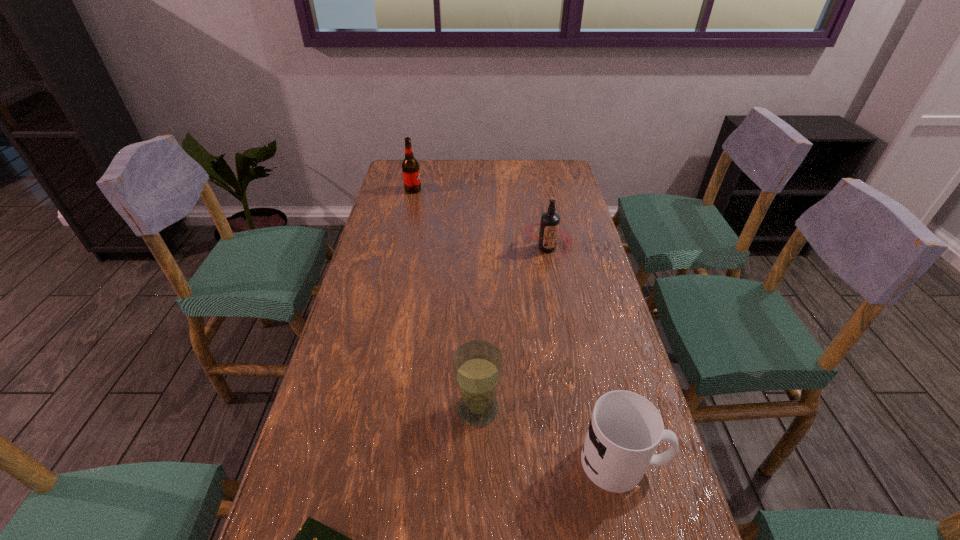
You are a GUI agent. You are given a task and a screenshot of the screen. Output one action in this format:
    pyautogui.click(x=<x>, y=<y>)
    Task: Click on the vacant area that lies between the third object from right to left and the farthest object
    
    Given the screenshot: What is the action you would take?
    pyautogui.click(x=445, y=299)

The width and height of the screenshot is (960, 540). I want to click on empty space between the glass and the farther root beer, so click(445, 299).

The height and width of the screenshot is (540, 960). I want to click on vacant region between the second nearest object and the glass, so click(x=550, y=435).

You are a GUI agent. You are given a task and a screenshot of the screen. Output one action in this format:
    pyautogui.click(x=<x>, y=<y>)
    Task: Click on the vacant area that lies between the glass and the left root beer
    
    Given the screenshot: What is the action you would take?
    pyautogui.click(x=445, y=299)

You are a GUI agent. You are given a task and a screenshot of the screen. Output one action in this format:
    pyautogui.click(x=<x>, y=<y>)
    Task: Click on the free area in between the mug and the glass
    The image size is (960, 540).
    Given the screenshot: What is the action you would take?
    pyautogui.click(x=550, y=435)

Identify the location of object that is the third closest to the left root beer. The height and width of the screenshot is (540, 960). (625, 429).

Locate which object ranks third in proximity to the book. Please provide its 2D coordinates. Your answer should be formatted as a tuple, i.e. [(x, y)], where the tuple contains the x and y coordinates of a point satisfying the conditions above.

[(549, 226)]